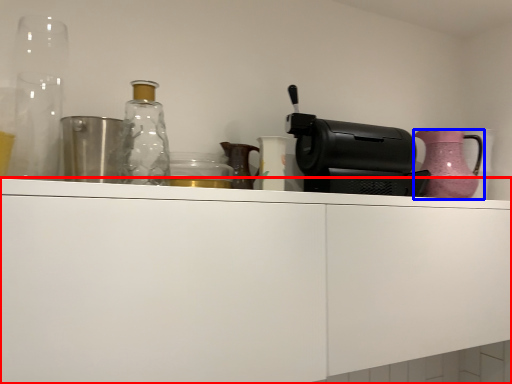
Question: Which object is further to the camera taking this photo, cabinetry (highlighted by a red box) or jug (highlighted by a blue box)?

Choices:
 (A) cabinetry
 (B) jug

Answer: (B)